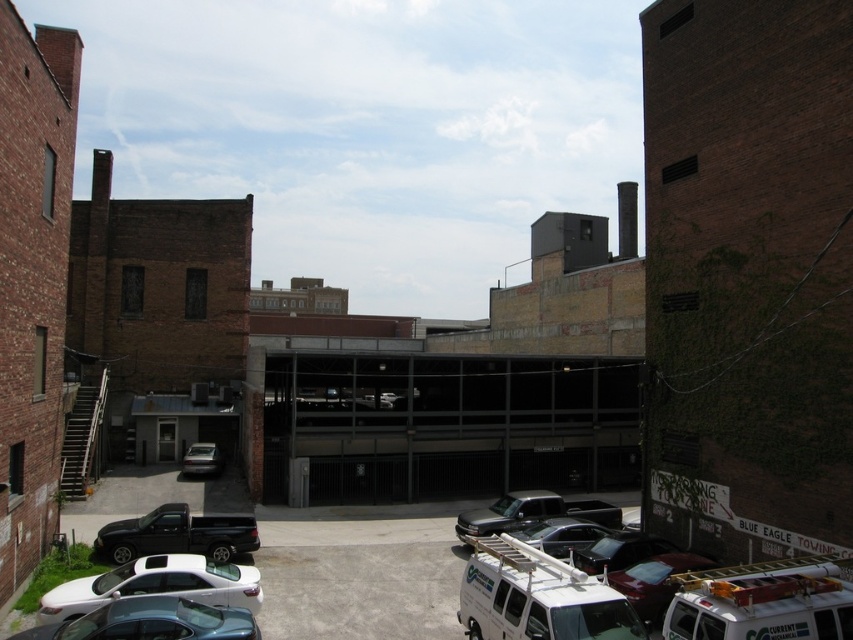
Can you confirm if white plastic ladder at lower right is wider than shiny black truck at lower left?

Yes, white plastic ladder at lower right is wider than shiny black truck at lower left.

In order to click on white plastic ladder at lower right in this screenshot , I will do `click(761, 602)`.

Based on the photo, does teal glossy sedan at lower left have a larger size compared to shiny black car at center?

Correct, teal glossy sedan at lower left is larger in size than shiny black car at center.

The height and width of the screenshot is (640, 853). Describe the element at coordinates (151, 621) in the screenshot. I see `teal glossy sedan at lower left` at that location.

Locate an element on the screen. teal glossy sedan at lower left is located at coordinates (151, 621).

Is point (137, 609) positioned in front of point (567, 502)?

Yes, point (137, 609) is in front of point (567, 502).

Who is taller, teal glossy sedan at lower left or matte black truck at center?

matte black truck at center is taller.

Is point (225, 611) farther from viewer compared to point (463, 524)?

No, it is in front of (463, 524).

This screenshot has height=640, width=853. Identify the location of teal glossy sedan at lower left. (151, 621).